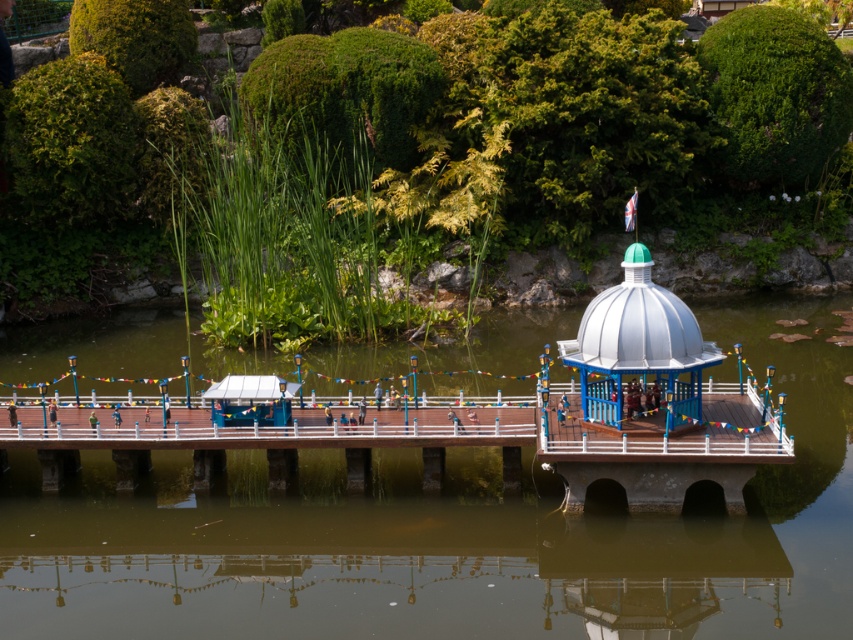
You are standing in front of the waterfront model and want to take a photo that includes both the white glossy gazebo at upper right and the white glossy dome at center. Which object will appear larger in your photo?

The white glossy gazebo at upper right will appear larger in the photo because it is closer to the viewer than the white glossy dome at center.

You are an architect designing a new model village and want to place a decorative item between the white glossy gazebo at upper right and the white glossy dome at center. Considering their widths, which object should you place closer to the narrower one to maintain balance?

The white glossy dome at center is narrower than the white glossy gazebo at upper right. To maintain balance, place the decorative item closer to the white glossy dome at center since it has a smaller width.